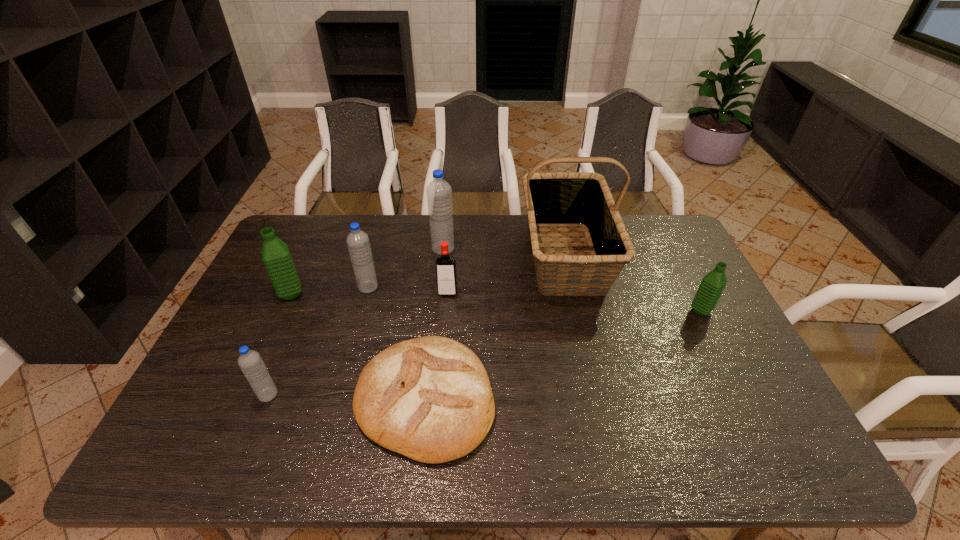
Image resolution: width=960 pixels, height=540 pixels. Identify the location of object that is the fifth nearest to the right green water bottle. (357, 241).

You are a GUI agent. You are given a task and a screenshot of the screen. Output one action in this format:
    pyautogui.click(x=<x>, y=<y>)
    Task: Click on the third closest object to the red vodka
    
    Given the screenshot: What is the action you would take?
    pyautogui.click(x=429, y=398)

Where is `water bottle that is the second closest to the second blue water bottle from right to left`? Image resolution: width=960 pixels, height=540 pixels. water bottle that is the second closest to the second blue water bottle from right to left is located at coordinates (439, 192).

Locate which water bottle ranks in proximity to the smallest blue water bottle. Please provide its 2D coordinates. Your answer should be formatted as a tuple, i.e. [(x, y)], where the tuple contains the x and y coordinates of a point satisfying the conditions above.

[(276, 257)]

In order to click on blue water bottle object that ranks as the second closest to the vodka in this screenshot , I will do `click(357, 241)`.

Point out which blue water bottle is positioned as the nearest to the nearest blue water bottle. Please provide its 2D coordinates. Your answer should be formatted as a tuple, i.e. [(x, y)], where the tuple contains the x and y coordinates of a point satisfying the conditions above.

[(357, 241)]

Locate an element on the screen. The width and height of the screenshot is (960, 540). vacant region that satisfies the following two spatial constraints: 1. on the front side of the shortest object; 2. on the right side of the nearest water bottle is located at coordinates (266, 400).